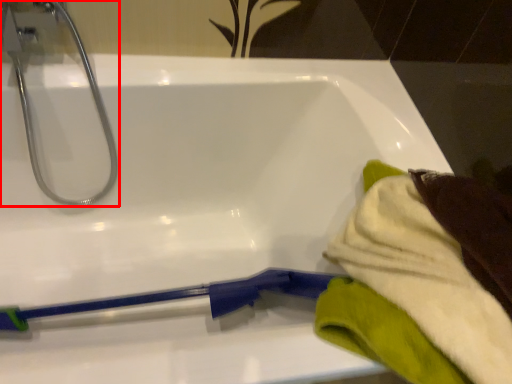
Question: In this image, where is tap (annotated by the red box) located relative to bath towel?

Choices:
 (A) right
 (B) left

Answer: (B)